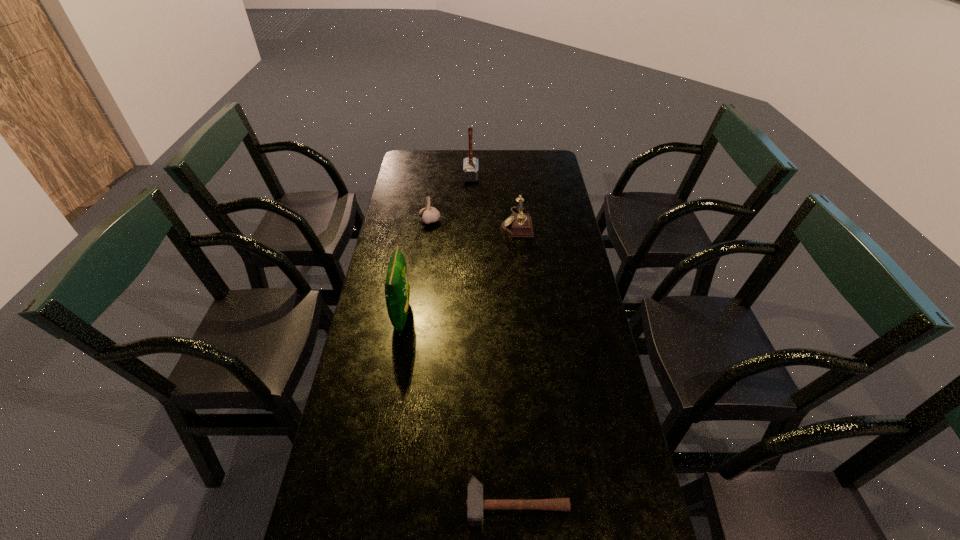
You are a GUI agent. You are given a task and a screenshot of the screen. Output one action in this format:
    pyautogui.click(x=<x>, y=<y>)
    Task: Click on the farther hammer
    The height and width of the screenshot is (540, 960).
    Given the screenshot: What is the action you would take?
    pyautogui.click(x=470, y=165)

The width and height of the screenshot is (960, 540). Find the location of `the farthest object`. the farthest object is located at coordinates (470, 165).

At what (x,y) coordinates should I click in order to perform the action: click on crisp (potato chip). Please return your answer as a coordinate pair (x, y). Looking at the image, I should click on (397, 290).

At what (x,y) coordinates should I click in order to perform the action: click on telephone. Please return your answer as a coordinate pair (x, y). Looking at the image, I should click on (519, 224).

What are the coordinates of `garlic` in the screenshot? It's located at tap(428, 214).

Locate an element on the screen. The width and height of the screenshot is (960, 540). the nearest object is located at coordinates (475, 504).

Where is `the nearer hammer`? The width and height of the screenshot is (960, 540). the nearer hammer is located at coordinates (475, 504).

I want to click on vacant space situated 0.060m on the striking surface of the farther hammer, so click(492, 176).

Locate an element on the screen. blank space located 0.330m on the front-facing side of the second nearest object is located at coordinates (516, 316).

In order to click on vacant space located 0.050m on the dial of the telephone in this screenshot , I will do `click(487, 223)`.